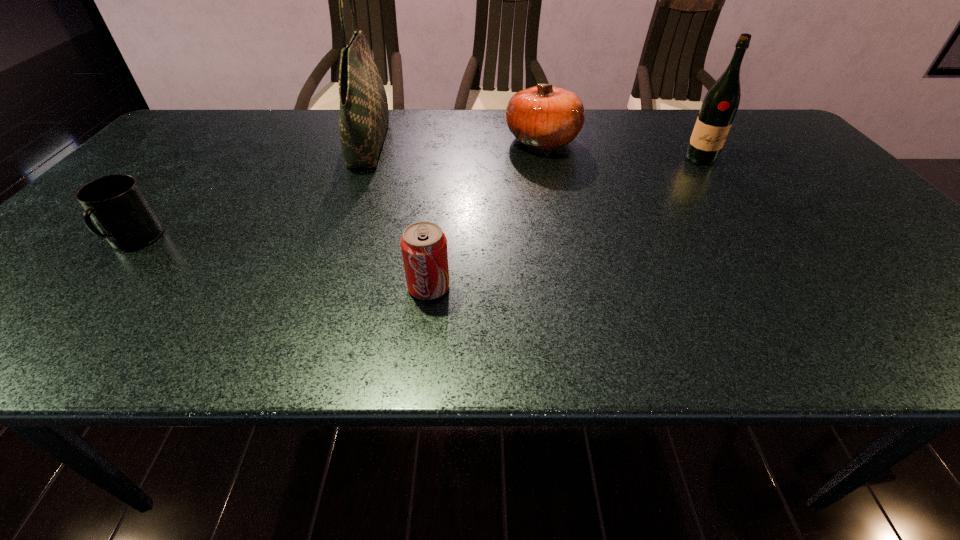
You are a GUI agent. You are given a task and a screenshot of the screen. Output one action in this format:
    pyautogui.click(x=<x>, y=<y>)
    Task: Click on the free spot between the pumpkin and the tote bag
    The width and height of the screenshot is (960, 540).
    Given the screenshot: What is the action you would take?
    pyautogui.click(x=456, y=142)

Locate an element on the screen. The width and height of the screenshot is (960, 540). vacant point located between the fourth farthest object and the third object from left to right is located at coordinates (281, 264).

Select which object appears as the fourth closest to the mug. Please provide its 2D coordinates. Your answer should be formatted as a tuple, i.e. [(x, y)], where the tuple contains the x and y coordinates of a point satisfying the conditions above.

[(719, 107)]

Locate an element on the screen. the closest object to the soda can is located at coordinates (364, 116).

This screenshot has height=540, width=960. Identify the location of free space that satisfies the following two spatial constraints: 1. on the back side of the tallest object; 2. on the right side of the pumpkin. (371, 141).

The image size is (960, 540). I want to click on vacant area that satisfies the following two spatial constraints: 1. on the side of the third object from right to left with the handle; 2. on the right side of the fourth farthest object, so click(94, 287).

You are a GUI agent. You are given a task and a screenshot of the screen. Output one action in this format:
    pyautogui.click(x=<x>, y=<y>)
    Task: Click on the vacant area that satisfies the following two spatial constraints: 1. on the side of the third object from right to left with the handle; 2. on the left side of the fourth farthest object
    
    Given the screenshot: What is the action you would take?
    pyautogui.click(x=94, y=287)